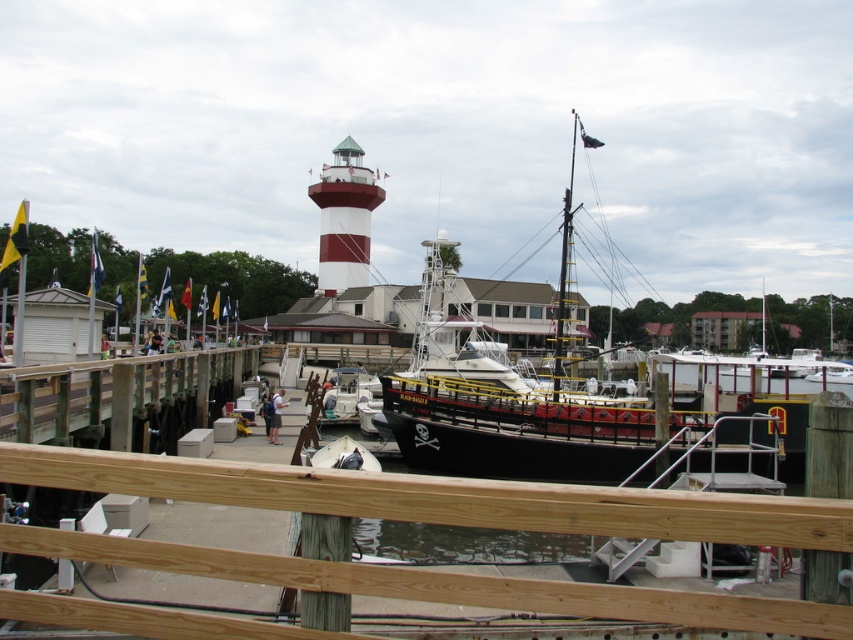
Question: Is black matte pirate ship at center below white fabric shirt at center?

Choices:
 (A) yes
 (B) no

Answer: (B)

Question: Which point is farther to the camera?

Choices:
 (A) black matte pirate ship at center
 (B) white fabric shirt at center
 (C) blue fabric shirt at center
 (D) wooden at center

Answer: (C)

Question: Which of these objects is positioned closest to the black matte pirate ship at center?

Choices:
 (A) blue fabric shirt at center
 (B) white fabric shirt at center
 (C) wooden at center

Answer: (C)

Question: Can you confirm if black matte pirate ship at center is positioned to the left of blue fabric shirt at center?

Choices:
 (A) yes
 (B) no

Answer: (B)

Question: Which object is positioned closest to the white fabric shirt at center?

Choices:
 (A) wooden at center
 (B) blue fabric shirt at center

Answer: (B)

Question: Considering the relative positions of white fabric shirt at center and blue fabric shirt at center in the image provided, where is white fabric shirt at center located with respect to blue fabric shirt at center?

Choices:
 (A) above
 (B) below

Answer: (B)